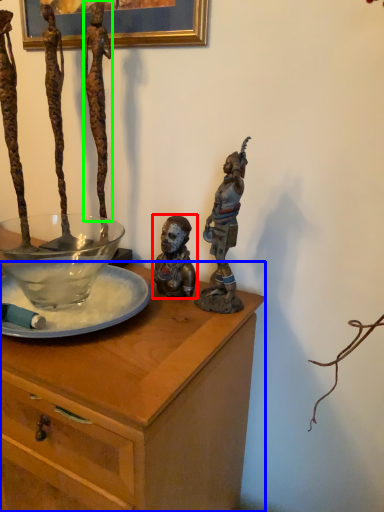
Question: Which object is positioned closest to person (highlighted by a red box)? Select from desk (highlighted by a blue box) and person (highlighted by a green box).

Choices:
 (A) desk
 (B) person

Answer: (A)